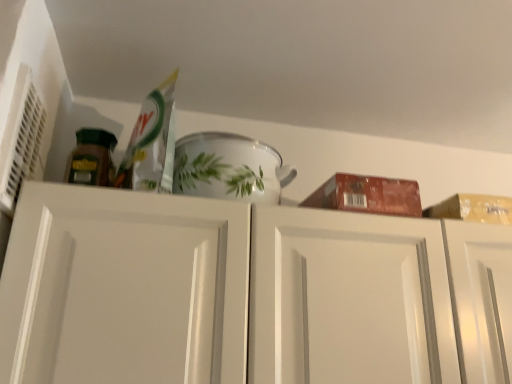
Question: Is white glossy bowl at upper center located outside white matte cabinet doors at upper center?

Choices:
 (A) yes
 (B) no

Answer: (A)

Question: Does white glossy bowl at upper center have a smaller size compared to white matte cabinet doors at upper center?

Choices:
 (A) no
 (B) yes

Answer: (B)

Question: Can you confirm if white glossy bowl at upper center is bigger than white matte cabinet doors at upper center?

Choices:
 (A) no
 (B) yes

Answer: (A)

Question: Can you confirm if white glossy bowl at upper center is shorter than white matte cabinet doors at upper center?

Choices:
 (A) yes
 (B) no

Answer: (A)

Question: Does white glossy bowl at upper center have a lesser width compared to white matte cabinet doors at upper center?

Choices:
 (A) no
 (B) yes

Answer: (B)

Question: From a real-world perspective, is white glossy bowl at upper center located beneath white matte cabinet doors at upper center?

Choices:
 (A) no
 (B) yes

Answer: (A)

Question: From the image's perspective, is white matte cabinet doors at upper center on white glossy bowl at upper center?

Choices:
 (A) yes
 (B) no

Answer: (B)

Question: Considering the relative sizes of white matte cabinet doors at upper center and white glossy bowl at upper center in the image provided, is white matte cabinet doors at upper center smaller than white glossy bowl at upper center?

Choices:
 (A) no
 (B) yes

Answer: (A)

Question: Are white matte cabinet doors at upper center and white glossy bowl at upper center making contact?

Choices:
 (A) yes
 (B) no

Answer: (B)

Question: Is white matte cabinet doors at upper center thinner than white glossy bowl at upper center?

Choices:
 (A) no
 (B) yes

Answer: (A)

Question: From a real-world perspective, does white matte cabinet doors at upper center stand above white glossy bowl at upper center?

Choices:
 (A) yes
 (B) no

Answer: (B)

Question: Is the depth of white matte cabinet doors at upper center less than that of white glossy bowl at upper center?

Choices:
 (A) yes
 (B) no

Answer: (A)

Question: From a real-world perspective, relative to white glossy bowl at upper center, is white matte cabinet doors at upper center vertically above or below?

Choices:
 (A) below
 (B) above

Answer: (A)